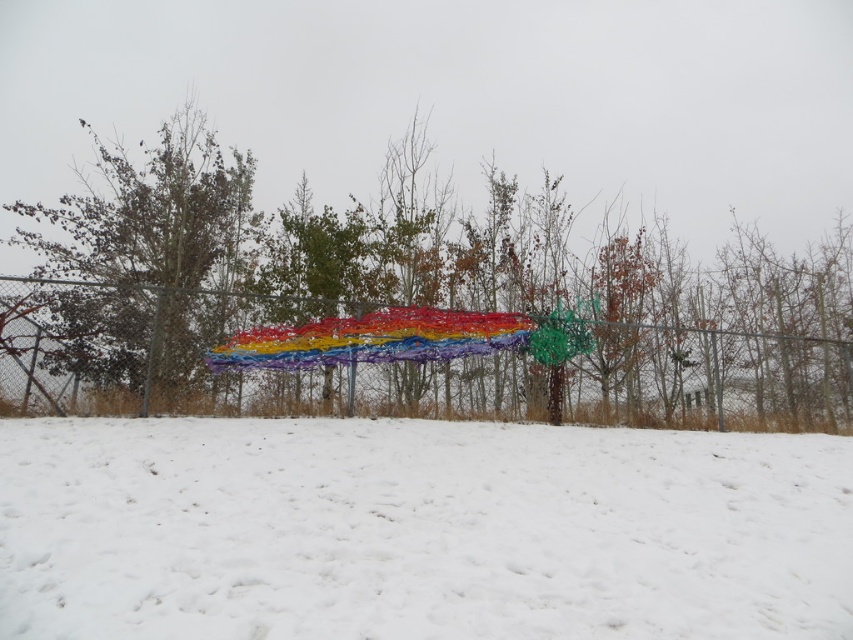
Does multicolored wire sculpture at center lie behind rainbow fabric blanket at center?

No, multicolored wire sculpture at center is closer to the viewer.

Between multicolored wire sculpture at center and rainbow fabric blanket at center, which one has less height?

Standing shorter between the two is rainbow fabric blanket at center.

Is point (444, 310) positioned before point (428, 326)?

No, it is not.

Where is `multicolored wire sculpture at center`? multicolored wire sculpture at center is located at coordinates (412, 300).

Can you confirm if brown textured tree at left is positioned to the right of rainbow fabric blanket at center?

No, brown textured tree at left is not to the right of rainbow fabric blanket at center.

Measure the distance between brown textured tree at left and camera.

brown textured tree at left is 13.78 meters away from camera.

The height and width of the screenshot is (640, 853). I want to click on brown textured tree at left, so click(x=144, y=248).

Between point (337, 502) and point (51, 276), which one is positioned in front?

Point (337, 502) is in front.

Can you confirm if white fluffy snow at lower center is positioned to the right of brown textured tree at left?

Yes, white fluffy snow at lower center is to the right of brown textured tree at left.

Identify the location of white fluffy snow at lower center. The width and height of the screenshot is (853, 640). (418, 531).

This screenshot has width=853, height=640. Find the location of `white fluffy snow at lower center`. white fluffy snow at lower center is located at coordinates (418, 531).